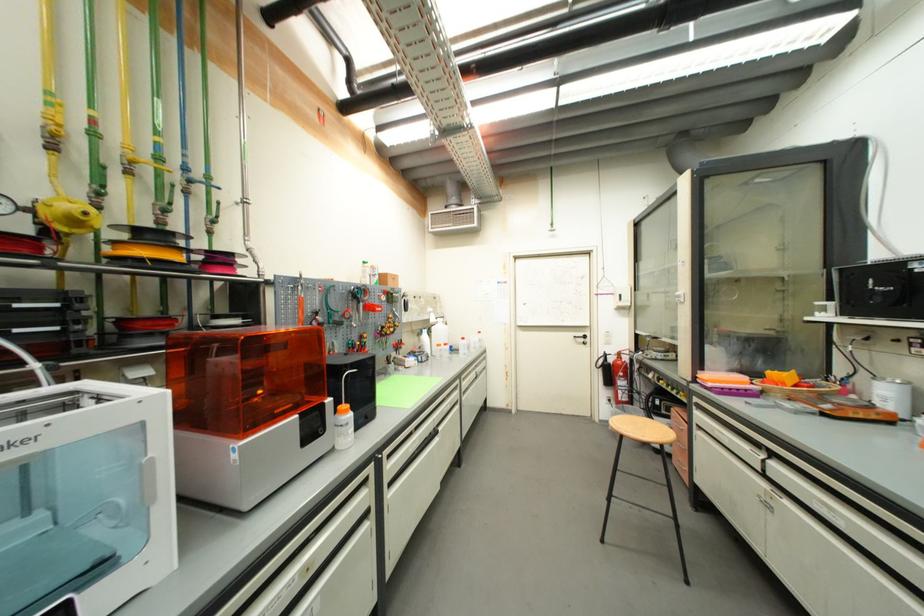
At what (x,y) coordinates should I click in order to perform the action: click on blue valve handle. Please return your answer as a coordinate pair (x, y). Looking at the image, I should click on (331, 307).